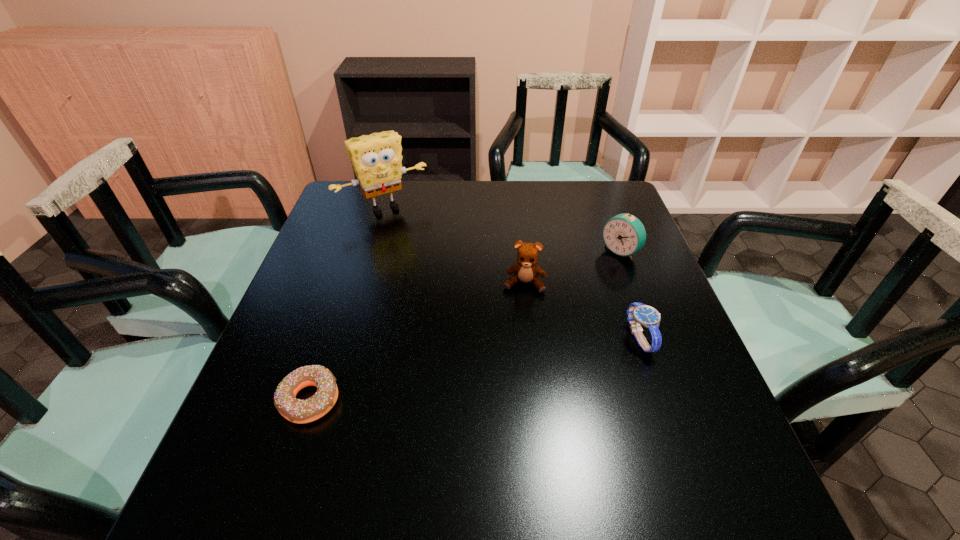
Image resolution: width=960 pixels, height=540 pixels. I want to click on vacant region at the left edge of the desktop, so click(274, 375).

Identify the location of vacant space at the right edge of the desktop. This screenshot has width=960, height=540. (591, 240).

Find the location of a particular element. vacant space at the far left corner of the desktop is located at coordinates (357, 185).

Where is `vacant area between the teddy bear and the watch`? This screenshot has height=540, width=960. vacant area between the teddy bear and the watch is located at coordinates (582, 311).

At what (x,y) coordinates should I click in order to perform the action: click on free space between the fourth tallest object and the nearest object. Please return your answer as a coordinate pair (x, y). The image size is (960, 540). Looking at the image, I should click on (474, 369).

Where is `blank region between the doughnut and the teddy bear`? Image resolution: width=960 pixels, height=540 pixels. blank region between the doughnut and the teddy bear is located at coordinates (417, 342).

Where is `blank region between the teddy bear and the second farthest object`? The height and width of the screenshot is (540, 960). blank region between the teddy bear and the second farthest object is located at coordinates (572, 268).

At what (x,y) coordinates should I click in order to perform the action: click on unoccupied position between the sponge and the alarm clock. Please return your answer as a coordinate pair (x, y). This screenshot has width=960, height=540. Looking at the image, I should click on (502, 230).

At what (x,y) coordinates should I click in order to perform the action: click on vacant space in between the fourth tallest object and the shortest object. Please return your answer as a coordinate pair (x, y). Looking at the image, I should click on (474, 369).

Locate an element on the screen. vacant area that lies between the third nearest object and the tallest object is located at coordinates (454, 246).